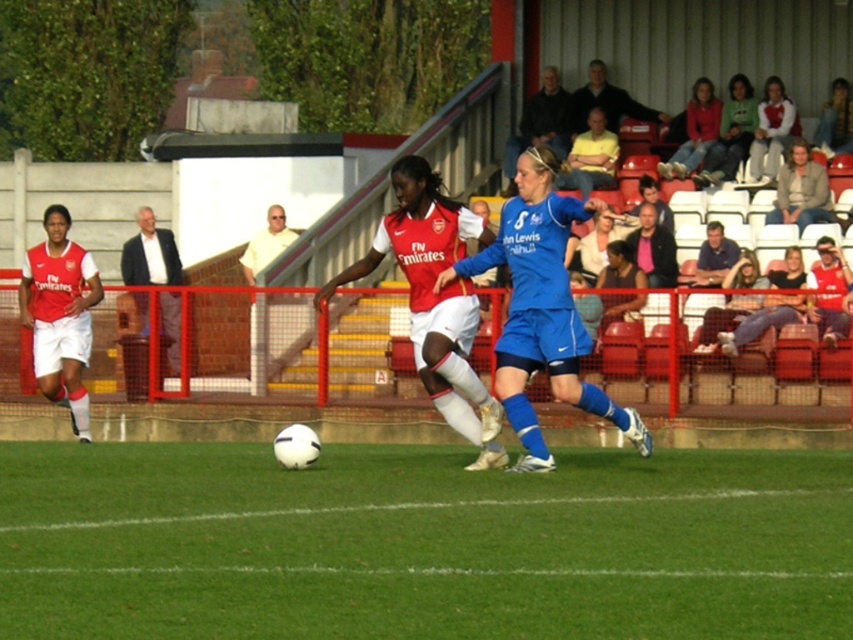
Question: Which of these objects is positioned closest to the light brown leather jacket at upper center?

Choices:
 (A) matte red jacket at upper right
 (B) blue matte soccer player at center
 (C) matte white jersey at center

Answer: (A)

Question: Which object is closer to the camera taking this photo?

Choices:
 (A) matte white shirt at center
 (B) blue matte soccer player at center
 (C) white jersey at center
 (D) white matte soccer ball at center

Answer: (D)

Question: Is matte white jersey at center bigger than matte red jersey at left?

Choices:
 (A) yes
 (B) no

Answer: (A)

Question: Is matte white jersey at center further to camera compared to light brown leather jacket at upper right?

Choices:
 (A) yes
 (B) no

Answer: (B)

Question: Can you confirm if white matte soccer ball at center is smaller than white shirt at left?

Choices:
 (A) no
 (B) yes

Answer: (A)

Question: Which object is positioned closest to the dark gray jacket at upper center?

Choices:
 (A) matte white shirt at center
 (B) matte red jacket at upper right
 (C) matte red jersey at left
 (D) light brown leather jacket at upper center

Answer: (D)